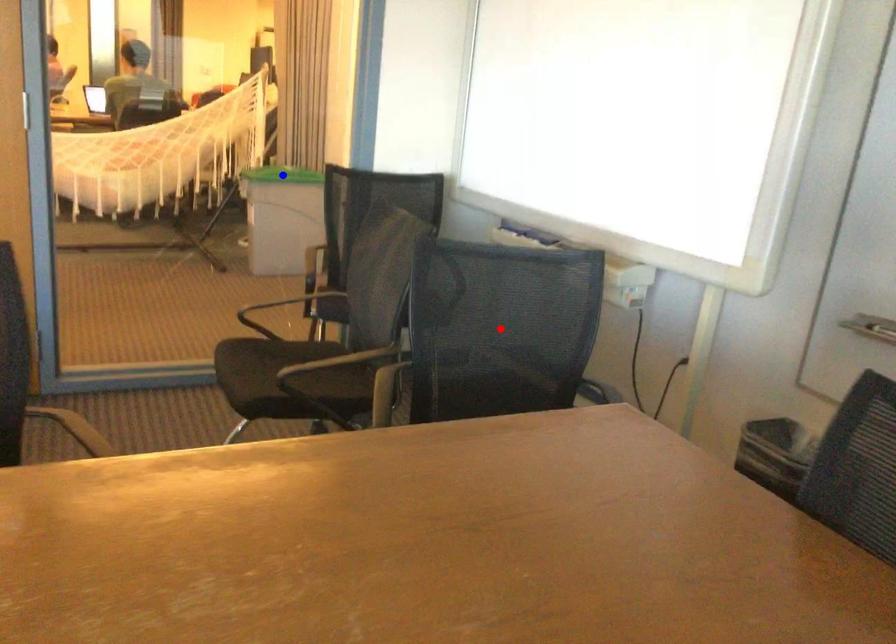
Question: In the image, two points are highlighted. Which point is nearer to the camera? Reply with the corresponding letter.

Choices:
 (A) blue point
 (B) red point

Answer: (B)